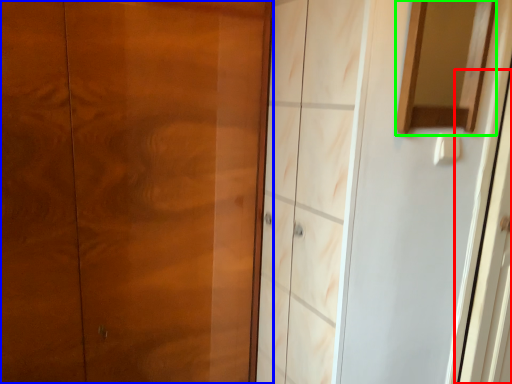
Question: Which is nearer to the screen door (highlighted by a red box)? door (highlighted by a blue box) or mirror (highlighted by a green box).

Choices:
 (A) door
 (B) mirror

Answer: (B)